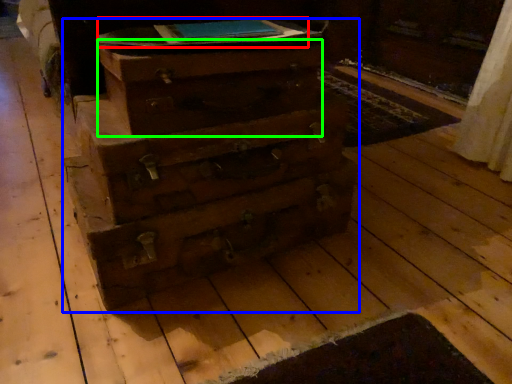
Question: Considering the real-world distances, which object is farthest from book (highlighted by a red box)? chest of drawers (highlighted by a blue box) or drawer (highlighted by a green box)?

Choices:
 (A) chest of drawers
 (B) drawer

Answer: (A)